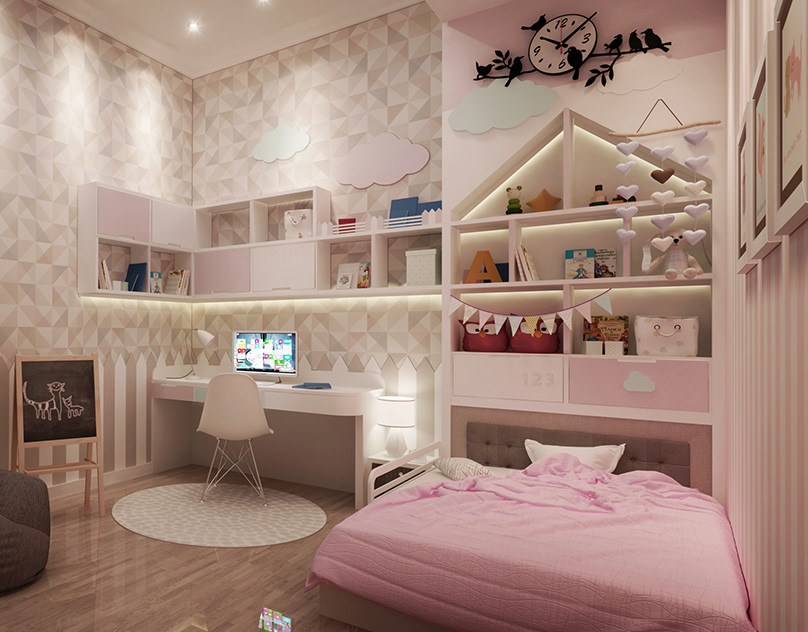
Image resolution: width=808 pixels, height=632 pixels. Find the location of `beige headboard`. beige headboard is located at coordinates (485, 440).